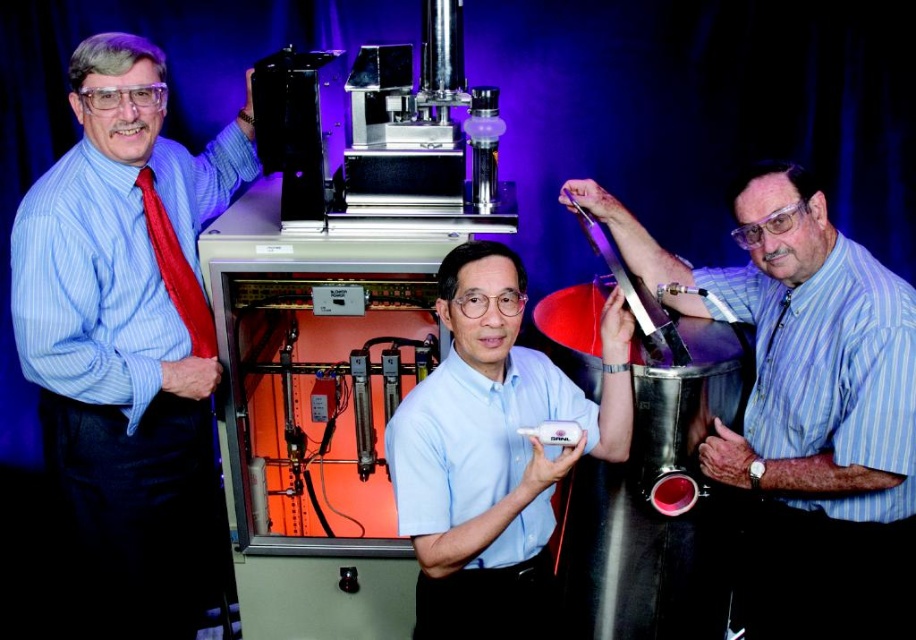
Question: Which of the following is the closest to the observer?

Choices:
 (A) (183, 316)
 (B) (851, 611)

Answer: (B)

Question: Can you confirm if white plastic remote at center is thinner than red silk tie at left?

Choices:
 (A) no
 (B) yes

Answer: (A)

Question: Which of the following is the closest to the observer?

Choices:
 (A) (751, 572)
 (B) (158, 257)

Answer: (B)

Question: Which point is farther to the camera?

Choices:
 (A) pyautogui.click(x=183, y=296)
 (B) pyautogui.click(x=418, y=397)

Answer: (A)

Question: Is matte blue shirt at right thinner than red silk tie at left?

Choices:
 (A) no
 (B) yes

Answer: (A)

Question: Is blue striped shirt at left to the right of matte blue shirt at right from the viewer's perspective?

Choices:
 (A) no
 (B) yes

Answer: (A)